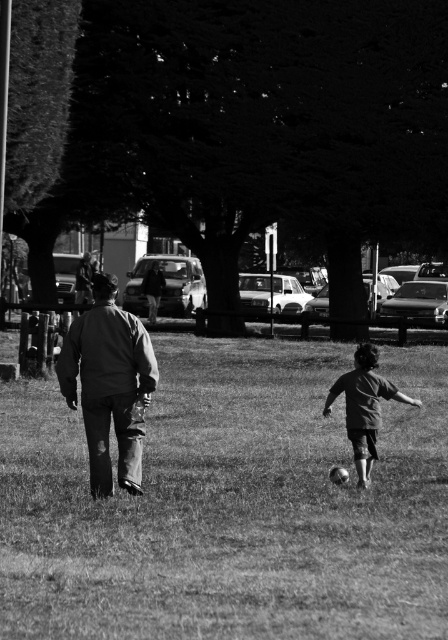
Question: Among these points, which one is nearest to the camera?

Choices:
 (A) (124, 369)
 (B) (375, 412)
 (C) (196, 436)

Answer: (A)

Question: Which point is farther from the camera taking this photo?

Choices:
 (A) (366, 483)
 (B) (78, 337)

Answer: (A)

Question: Which point is farther from the camera taking this photo?

Choices:
 (A) (43, 461)
 (B) (107, 276)
 (C) (357, 396)

Answer: (A)

Question: Can you confirm if grassy at center is wider than ripped denim jacket at center?

Choices:
 (A) yes
 (B) no

Answer: (A)

Question: In this image, where is ripped denim jacket at center located relative to dark gray cotton shirt at lower right?

Choices:
 (A) right
 (B) left

Answer: (B)

Question: Can you confirm if grassy at center is positioned to the right of dark gray cotton shirt at lower right?

Choices:
 (A) yes
 (B) no

Answer: (B)